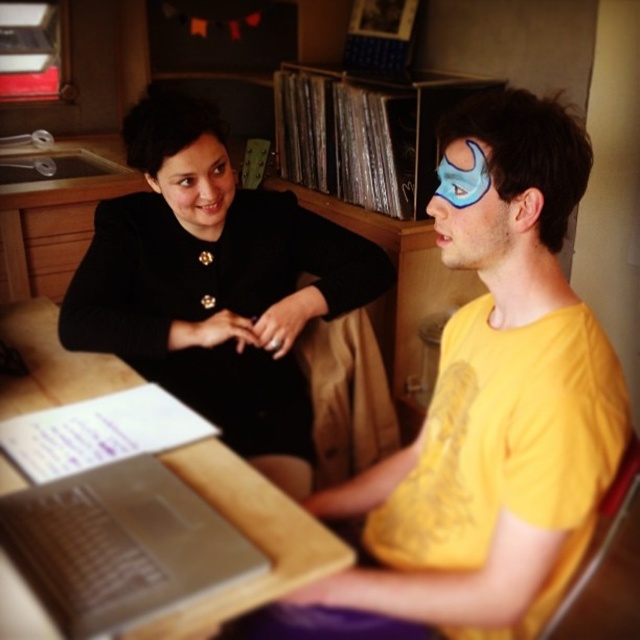
Question: Based on their relative distances, which object is farther from the blue matte face paint at upper right?

Choices:
 (A) black fabric dress at upper left
 (B) silver metallic table at center

Answer: (B)

Question: Is yellow matte/yellow t-shirt at right below blue matte face paint at upper right?

Choices:
 (A) yes
 (B) no

Answer: (A)

Question: Is yellow matte/yellow t-shirt at right to the right of blue matte face paint at upper right from the viewer's perspective?

Choices:
 (A) yes
 (B) no

Answer: (A)

Question: Does silver metallic table at center appear on the left side of blue matte face paint at upper right?

Choices:
 (A) no
 (B) yes

Answer: (B)

Question: Estimate the real-world distances between objects in this image. Which object is closer to the silver metallic laptop at lower left?

Choices:
 (A) silver metallic table at center
 (B) yellow matte/yellow t-shirt at right

Answer: (A)

Question: Estimate the real-world distances between objects in this image. Which object is closer to the silver metallic table at center?

Choices:
 (A) blue matte face paint at upper right
 (B) black fabric dress at upper left
 (C) silver metallic laptop at lower left
 (D) yellow matte/yellow t-shirt at right

Answer: (C)